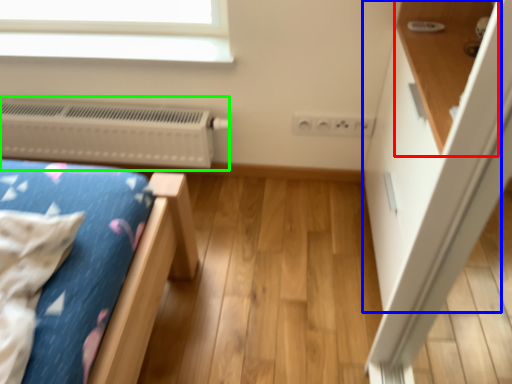
Question: Considering the real-world distances, which object is farthest from shelf (highlighted by a red box)? dresser (highlighted by a blue box) or heater (highlighted by a green box)?

Choices:
 (A) dresser
 (B) heater

Answer: (B)